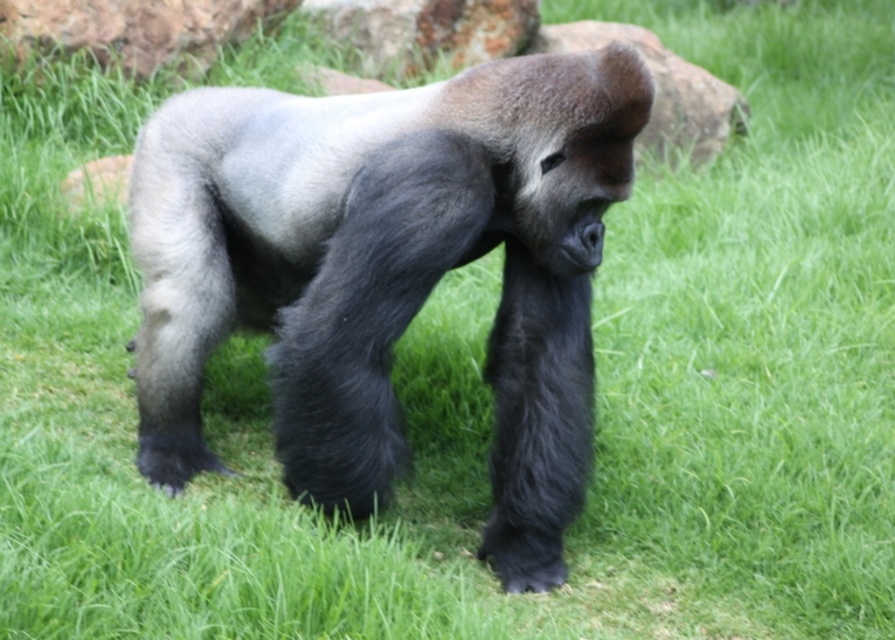
Is brown rock at upper left positioned behind rusty metal rock at upper center?

No, brown rock at upper left is in front of rusty metal rock at upper center.

Is point (203, 13) farther from viewer compared to point (440, 3)?

No, it is in front of (440, 3).

This screenshot has width=895, height=640. In order to click on brown rock at upper left in this screenshot , I will do `click(135, 28)`.

Does fuzzy gray gorilla at center have a greater height compared to green grass at lower left?

Yes.

The height and width of the screenshot is (640, 895). Find the location of `fuzzy gray gorilla at center`. fuzzy gray gorilla at center is located at coordinates (386, 272).

Between brown rock at upper left and green grass at lower left, which one appears on the left side from the viewer's perspective?

green grass at lower left is more to the left.

Is brown rock at upper left thinner than green grass at lower left?

In fact, brown rock at upper left might be wider than green grass at lower left.

Does point (87, 45) come behind point (111, 157)?

Yes, it is.

At what (x,y) coordinates should I click in order to perform the action: click on brown rock at upper left. Please return your answer as a coordinate pair (x, y). Image resolution: width=895 pixels, height=640 pixels. Looking at the image, I should click on (135, 28).